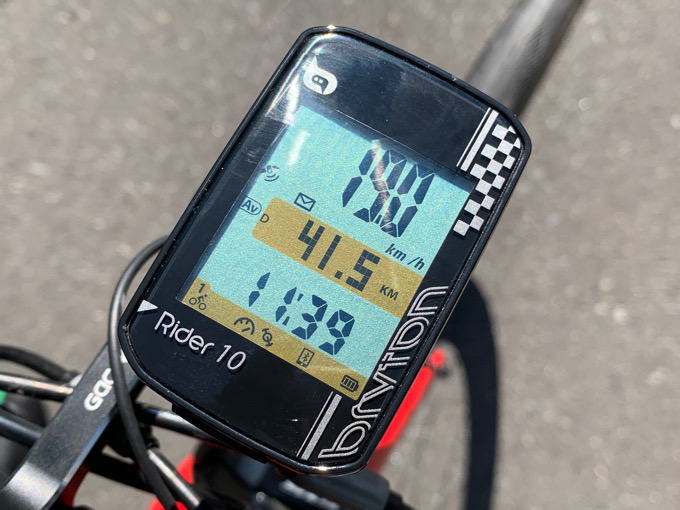
Identify the location of wires. (111, 326).